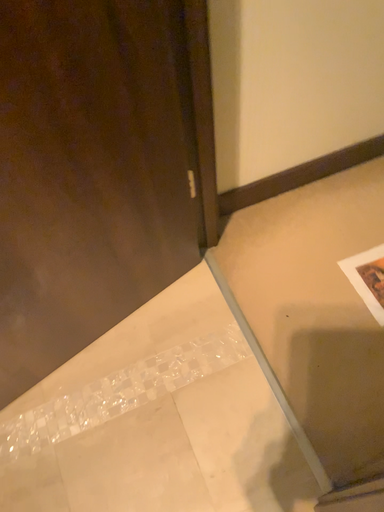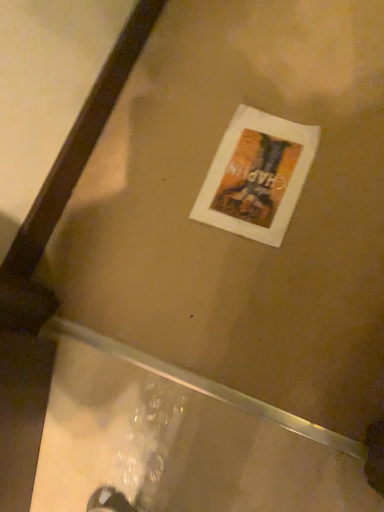
Question: Which way did the camera rotate in the video?

Choices:
 (A) rotated right
 (B) rotated left

Answer: (A)